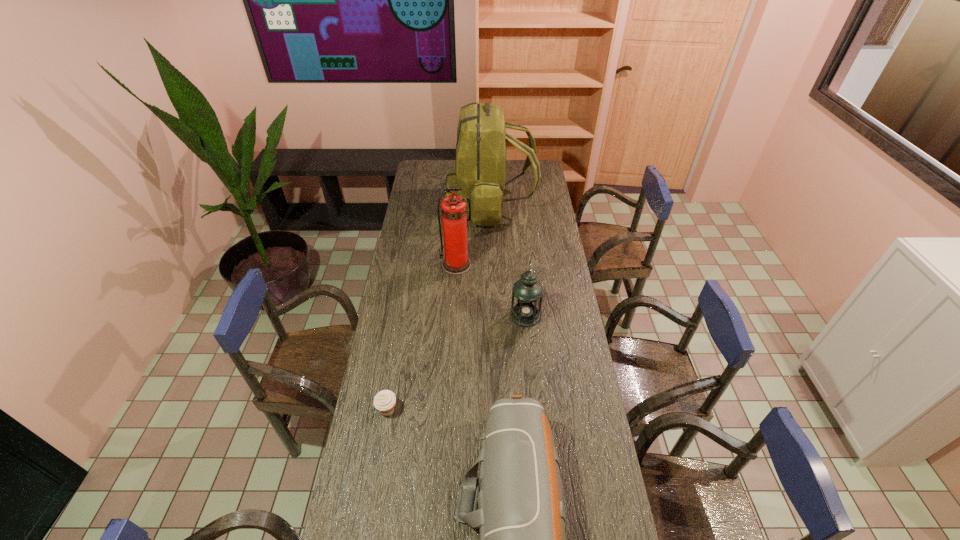
Where is `free space that satisfies the following two spatial constraints: 1. on the front-facing side of the backpack; 2. on the back side of the oil lamp`? The image size is (960, 540). free space that satisfies the following two spatial constraints: 1. on the front-facing side of the backpack; 2. on the back side of the oil lamp is located at coordinates (492, 316).

You are a GUI agent. You are given a task and a screenshot of the screen. Output one action in this format:
    pyautogui.click(x=<x>, y=<y>)
    Task: Click on the vacant region that satisfies the following two spatial constraints: 1. on the front-facing side of the backpack; 2. on the back side of the oil lamp
    
    Given the screenshot: What is the action you would take?
    pyautogui.click(x=492, y=316)